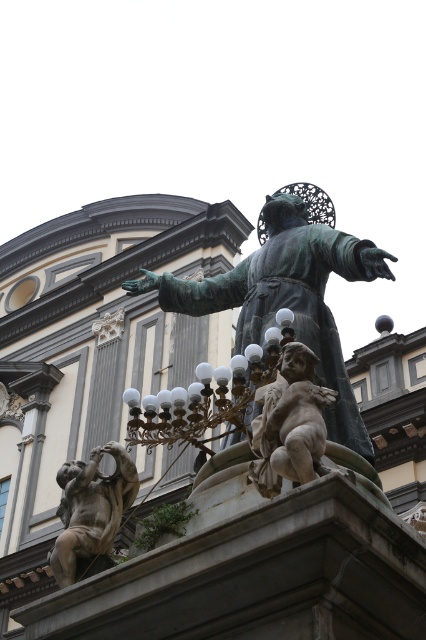
Can you confirm if smooth beige cherub at center is positioned to the left of bronze cherub at lower left?

Incorrect, smooth beige cherub at center is not on the left side of bronze cherub at lower left.

Describe the element at coordinates (290, 422) in the screenshot. I see `smooth beige cherub at center` at that location.

I want to click on smooth beige cherub at center, so click(x=290, y=422).

Between point (253, 276) and point (294, 403), which one is positioned in front?

Point (294, 403) is more forward.

This screenshot has height=640, width=426. In order to click on green patina statue at center in this screenshot , I will do click(287, 296).

Locate an element on the screen. The width and height of the screenshot is (426, 640). green patina statue at center is located at coordinates click(287, 296).

Is green patina statue at center shorter than bronze lamp at center?

Incorrect, green patina statue at center's height does not fall short of bronze lamp at center's.

Between green patina statue at center and bronze lamp at center, which one appears on the left side from the viewer's perspective?

Positioned to the left is bronze lamp at center.

Does point (321, 300) come in front of point (224, 432)?

No.

Image resolution: width=426 pixels, height=640 pixels. In order to click on green patina statue at center in this screenshot , I will do `click(287, 296)`.